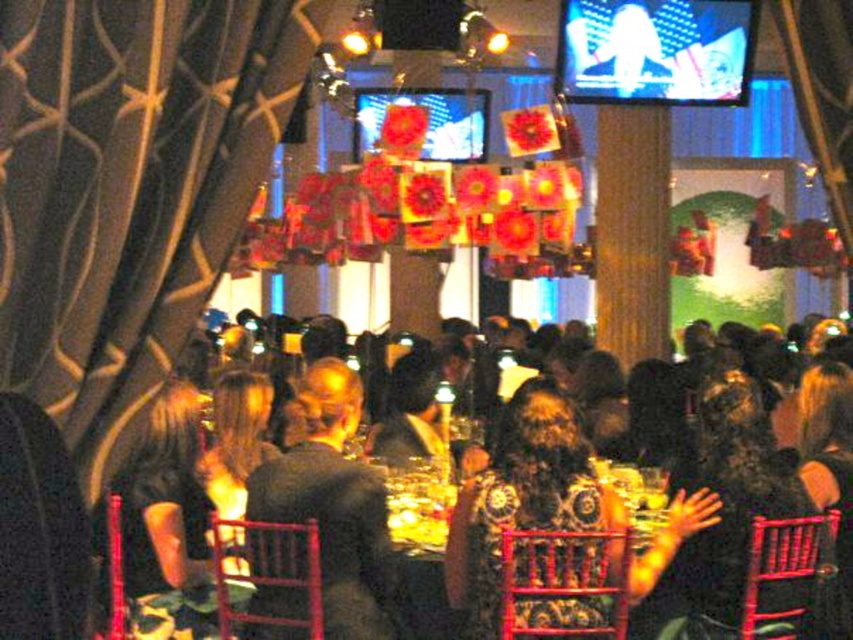
Does velvet drapery at left have a greater height compared to dark gray suit at center?

Incorrect, velvet drapery at left's height is not larger of dark gray suit at center's.

Who is taller, velvet drapery at left or dark gray suit at center?

With more height is dark gray suit at center.

Is point (99, 468) more distant than point (349, 547)?

No, it is in front of (349, 547).

Where is `velvet drapery at left`? The height and width of the screenshot is (640, 853). velvet drapery at left is located at coordinates (129, 188).

Can you confirm if velvet drapery at left is positioned to the left of dark hair at center?

Indeed, velvet drapery at left is positioned on the left side of dark hair at center.

Is velvet drapery at left smaller than dark hair at center?

Yes.

Does point (142, 268) lie behind point (260, 580)?

No, (142, 268) is closer to viewer.

Locate an element on the screen. This screenshot has height=640, width=853. velvet drapery at left is located at coordinates (129, 188).

Which is above, velvet drapery at left or dark brown leather jacket at center?

Positioned higher is velvet drapery at left.

What do you see at coordinates (129, 188) in the screenshot?
I see `velvet drapery at left` at bounding box center [129, 188].

The image size is (853, 640). I want to click on velvet drapery at left, so click(x=129, y=188).

You are a GUI agent. You are given a task and a screenshot of the screen. Output one action in this format:
    pyautogui.click(x=<x>, y=<y>)
    Task: Click on the velvet drapery at left
    
    Given the screenshot: What is the action you would take?
    pyautogui.click(x=129, y=188)